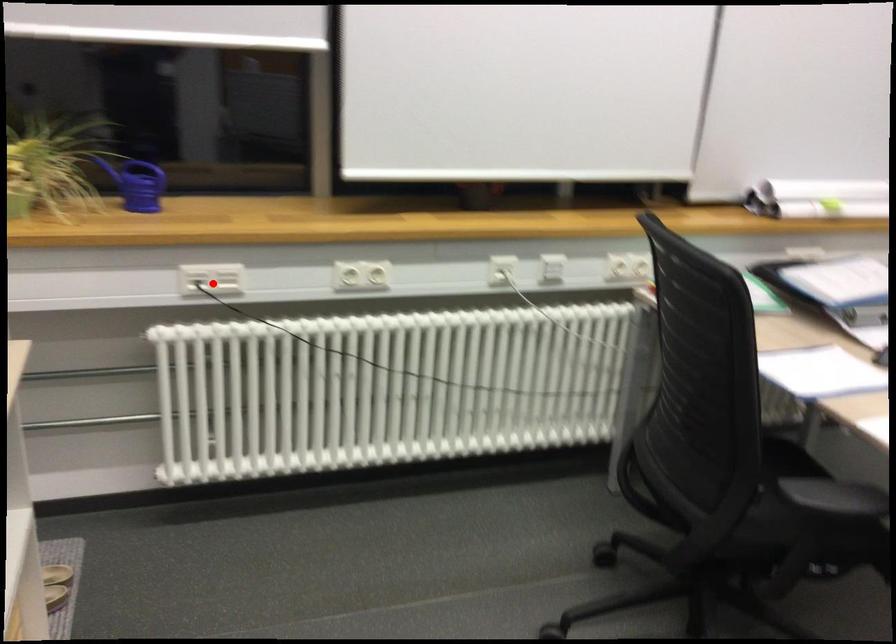
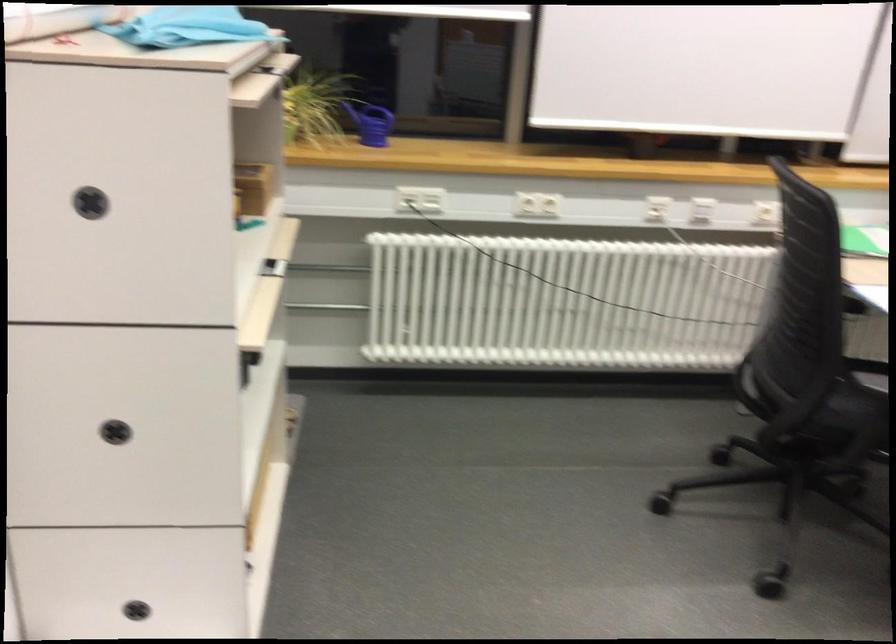
In the second image, find the point that corresponds to the highlighted location in the first image.

(419, 199)